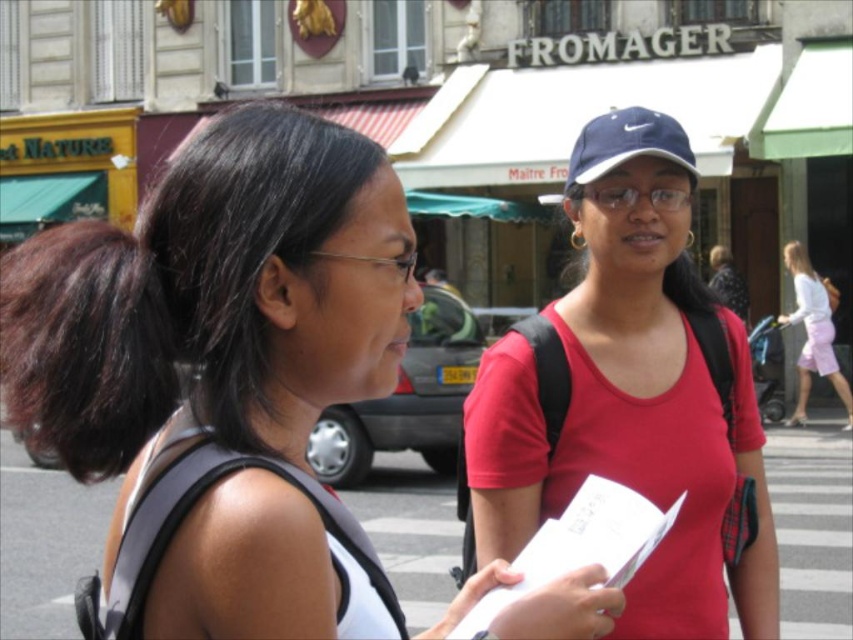
Question: Which of the following is the closest to the observer?

Choices:
 (A) matte black backpack at left
 (B) red matte tank top at center

Answer: (A)

Question: Where is matte black backpack at left located in relation to navy blue fabric baseball cap at upper right in the image?

Choices:
 (A) below
 (B) above

Answer: (A)

Question: Is red matte tank top at center bigger than navy blue fabric baseball cap at upper right?

Choices:
 (A) yes
 (B) no

Answer: (A)

Question: Which object is the farthest from the red matte tank top at center?

Choices:
 (A) navy blue fabric baseball cap at upper right
 (B) matte black backpack at left

Answer: (B)

Question: Which object is farther from the camera taking this photo?

Choices:
 (A) navy blue fabric baseball cap at upper right
 (B) red matte tank top at center

Answer: (A)

Question: Can you confirm if matte black backpack at left is smaller than red matte tank top at center?

Choices:
 (A) no
 (B) yes

Answer: (A)